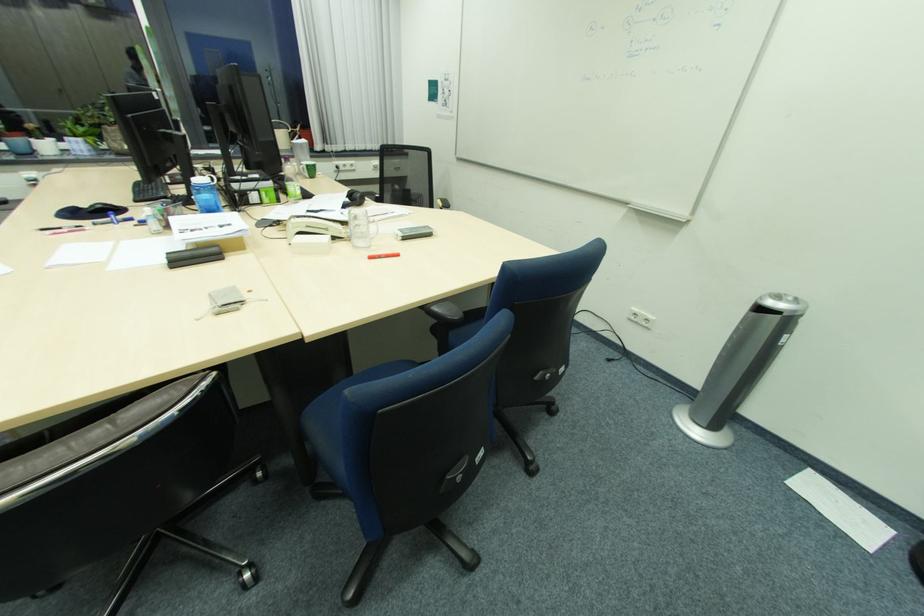
This screenshot has width=924, height=616. Describe the element at coordinates (444, 314) in the screenshot. I see `the blue chair armrest` at that location.